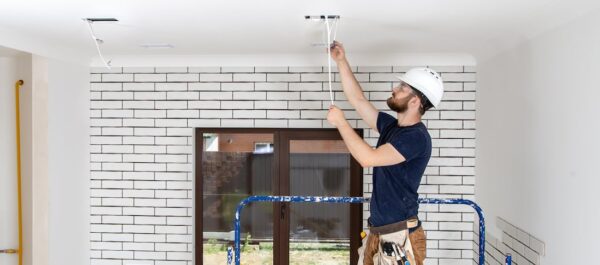
This screenshot has height=265, width=600. In order to click on white wall in this screenshot , I will do `click(498, 204)`.